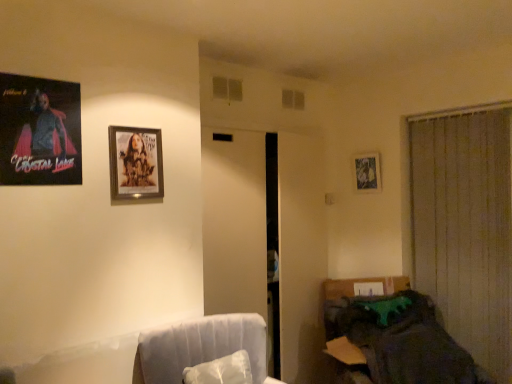
You are a GUI agent. You are given a task and a screenshot of the screen. Output one action in this format:
    pyautogui.click(x=<x>, y=<y>)
    Task: Click on the wooden frame at upper center, the 2th picture frame from the right
    This screenshot has width=512, height=384.
    Given the screenshot: What is the action you would take?
    pos(135,163)

What is the approximate height of metallic silver picture frame at upper right, the 1th picture frame when ordered from back to front?

metallic silver picture frame at upper right, the 1th picture frame when ordered from back to front, is 12.78 inches in height.

How much space does matte black poster at upper left, marked as the 3th picture frame in a back-to-front arrangement, occupy horizontally?

0.81 inches.

I want to click on beige fabric curtain at right, so click(465, 226).

Are white fabric swivel chair at lower left and wooden frame at upper center, the second picture frame when ordered from back to front, making contact?

No, white fabric swivel chair at lower left is not with wooden frame at upper center, the second picture frame when ordered from back to front.

Which of these two, white fabric swivel chair at lower left or wooden frame at upper center, the second picture frame from the left, stands taller?

white fabric swivel chair at lower left is taller.

How many degrees apart are the facing directions of white fabric swivel chair at lower left and wooden frame at upper center, the second picture frame from the left?

They differ by 17.8 degrees in their facing directions.

From the image's perspective, which one is positioned lower, metallic silver picture frame at upper right, the 1th picture frame when ordered from back to front, or wooden frame at upper center, the 2th picture frame from the right?

wooden frame at upper center, the 2th picture frame from the right, is shown below in the image.

Is metallic silver picture frame at upper right, the 3th picture frame positioned from the left, spatially inside wooden frame at upper center, the second picture frame when ordered from back to front, or outside of it?

metallic silver picture frame at upper right, the 3th picture frame positioned from the left, is not enclosed by wooden frame at upper center, the second picture frame when ordered from back to front.

Considering the sizes of objects metallic silver picture frame at upper right, the 1th picture frame when ordered from back to front, and wooden frame at upper center, the 2th picture frame from the right, in the image provided, who is thinner, metallic silver picture frame at upper right, the 1th picture frame when ordered from back to front, or wooden frame at upper center, the 2th picture frame from the right,?

wooden frame at upper center, the 2th picture frame from the right, is thinner.

Which object is more forward, beige fabric curtain at right or dark fabric couch at lower right?

dark fabric couch at lower right is closer to the camera.

Is beige fabric curtain at right touching dark fabric couch at lower right?

No, beige fabric curtain at right is not with dark fabric couch at lower right.

Can you confirm if beige fabric curtain at right is bigger than dark fabric couch at lower right?

Incorrect, beige fabric curtain at right is not larger than dark fabric couch at lower right.

Considering the relative positions of beige fabric curtain at right and dark fabric couch at lower right in the image provided, is beige fabric curtain at right to the right of dark fabric couch at lower right from the viewer's perspective?

Indeed, beige fabric curtain at right is positioned on the right side of dark fabric couch at lower right.

How far apart are matte black poster at upper left, marked as the 3th picture frame in a back-to-front arrangement, and dark fabric couch at lower right?

matte black poster at upper left, marked as the 3th picture frame in a back-to-front arrangement, and dark fabric couch at lower right are 1.93 meters apart from each other.

Can you see matte black poster at upper left, which is the 3th picture frame in right-to-left order, touching dark fabric couch at lower right?

No, matte black poster at upper left, which is the 3th picture frame in right-to-left order, is not in contact with dark fabric couch at lower right.

Which of these two, matte black poster at upper left, marked as the 3th picture frame in a back-to-front arrangement, or dark fabric couch at lower right, stands shorter?

matte black poster at upper left, marked as the 3th picture frame in a back-to-front arrangement.

From the picture: Between matte black poster at upper left, which is the 3th picture frame in right-to-left order, and dark fabric couch at lower right, which one has smaller width?

matte black poster at upper left, which is the 3th picture frame in right-to-left order, is thinner.

From the image's perspective, between dark fabric couch at lower right and metallic silver picture frame at upper right, the 1th picture frame when ordered from back to front, which one is located above?

metallic silver picture frame at upper right, the 1th picture frame when ordered from back to front, appears higher in the image.

In terms of width, does dark fabric couch at lower right look wider or thinner when compared to metallic silver picture frame at upper right, the 3th picture frame positioned from the left?

In the image, dark fabric couch at lower right appears to be wider than metallic silver picture frame at upper right, the 3th picture frame positioned from the left.

Is metallic silver picture frame at upper right, the 1th picture frame viewed from the right, located within dark fabric couch at lower right?

No, metallic silver picture frame at upper right, the 1th picture frame viewed from the right, is not inside dark fabric couch at lower right.

From a real-world perspective, is dark fabric couch at lower right on metallic silver picture frame at upper right, the 1th picture frame when ordered from back to front?

No, from a real-world perspective, dark fabric couch at lower right is not on top of metallic silver picture frame at upper right, the 1th picture frame when ordered from back to front.

In terms of height, does wooden frame at upper center, the second picture frame when ordered from back to front, look taller or shorter compared to metallic silver picture frame at upper right, the 3th picture frame positioned from the left?

In the image, wooden frame at upper center, the second picture frame when ordered from back to front, appears to be taller than metallic silver picture frame at upper right, the 3th picture frame positioned from the left.

Which object is closer to the camera taking this photo, wooden frame at upper center, the second picture frame when ordered from back to front, or metallic silver picture frame at upper right, the 1th picture frame when ordered from back to front?

wooden frame at upper center, the second picture frame when ordered from back to front, is closer to the camera.

From the image's perspective, is wooden frame at upper center, the second picture frame when ordered from back to front, above or below metallic silver picture frame at upper right, which is the third picture frame from front to back?

From the image's perspective, wooden frame at upper center, the second picture frame when ordered from back to front, appears below metallic silver picture frame at upper right, which is the third picture frame from front to back.

Can you confirm if wooden frame at upper center, the 2th picture frame from the right, is smaller than metallic silver picture frame at upper right, the 1th picture frame viewed from the right?

Indeed, wooden frame at upper center, the 2th picture frame from the right, has a smaller size compared to metallic silver picture frame at upper right, the 1th picture frame viewed from the right.

Is dark fabric couch at lower right completely or partially outside of white fabric swivel chair at lower left?

Absolutely, dark fabric couch at lower right is external to white fabric swivel chair at lower left.

In terms of height, does dark fabric couch at lower right look taller or shorter compared to white fabric swivel chair at lower left?

dark fabric couch at lower right is taller than white fabric swivel chair at lower left.

From a real-world perspective, is dark fabric couch at lower right beneath white fabric swivel chair at lower left?

Yes, from a real-world perspective, dark fabric couch at lower right is under white fabric swivel chair at lower left.

Locate an element on the screen. The height and width of the screenshot is (384, 512). the 1st picture frame counting from the left side of the white fabric swivel chair at lower left is located at coordinates (135, 163).

From a real-world perspective, starting from the metallic silver picture frame at upper right, the 1th picture frame when ordered from back to front, which picture frame is the 1st one vertically above it? Please provide its 2D coordinates.

[(135, 163)]

From the image, which object appears to be farther from dark fabric couch at lower right, wooden frame at upper center, the second picture frame from the left, or white fabric swivel chair at lower left?

wooden frame at upper center, the second picture frame from the left.

Estimate the real-world distances between objects in this image. Which object is further from matte black poster at upper left, which is counted as the first picture frame, starting from the front, beige fabric curtain at right or white fabric swivel chair at lower left?

beige fabric curtain at right lies further to matte black poster at upper left, which is counted as the first picture frame, starting from the front, than the other object.

Considering their positions, is beige fabric curtain at right positioned further to metallic silver picture frame at upper right, the 1th picture frame viewed from the right, than wooden frame at upper center, the 2th picture frame in the front-to-back sequence?

wooden frame at upper center, the 2th picture frame in the front-to-back sequence, is positioned further to the anchor metallic silver picture frame at upper right, the 1th picture frame viewed from the right.

Considering their positions, is matte black poster at upper left, which is counted as the first picture frame, starting from the front, positioned closer to wooden frame at upper center, the 2th picture frame in the front-to-back sequence, than beige fabric curtain at right?

Based on the image, matte black poster at upper left, which is counted as the first picture frame, starting from the front, appears to be nearer to wooden frame at upper center, the 2th picture frame in the front-to-back sequence.

Based on their spatial positions, is metallic silver picture frame at upper right, which is the third picture frame from front to back, or white fabric swivel chair at lower left closer to wooden frame at upper center, the second picture frame when ordered from back to front?

The object closer to wooden frame at upper center, the second picture frame when ordered from back to front, is white fabric swivel chair at lower left.

Estimate the real-world distances between objects in this image. Which object is further from beige fabric curtain at right, matte black poster at upper left, arranged as the first picture frame when viewed from the left, or white fabric swivel chair at lower left?

matte black poster at upper left, arranged as the first picture frame when viewed from the left, is positioned further to the anchor beige fabric curtain at right.

Looking at the image, which one is located further to wooden frame at upper center, the second picture frame when ordered from back to front, white fabric swivel chair at lower left or matte black poster at upper left, marked as the 3th picture frame in a back-to-front arrangement?

Among the two, white fabric swivel chair at lower left is located further to wooden frame at upper center, the second picture frame when ordered from back to front.

Considering their positions, is dark fabric couch at lower right positioned closer to matte black poster at upper left, arranged as the first picture frame when viewed from the left, than white fabric swivel chair at lower left?

The object closer to matte black poster at upper left, arranged as the first picture frame when viewed from the left, is white fabric swivel chair at lower left.

The height and width of the screenshot is (384, 512). What are the coordinates of `picture frame between wooden frame at upper center, the second picture frame from the left, and dark fabric couch at lower right from left to right` in the screenshot? It's located at (367, 173).

Locate an element on the screen. The image size is (512, 384). swivel chair between wooden frame at upper center, the 2th picture frame in the front-to-back sequence, and beige fabric curtain at right from left to right is located at coordinates pyautogui.click(x=200, y=346).

The width and height of the screenshot is (512, 384). In order to click on swivel chair between matte black poster at upper left, which is the 3th picture frame in right-to-left order, and beige fabric curtain at right, in the horizontal direction in this screenshot , I will do `click(200, 346)`.

Locate an element on the screen. The width and height of the screenshot is (512, 384). swivel chair located between matte black poster at upper left, marked as the 3th picture frame in a back-to-front arrangement, and dark fabric couch at lower right in the left-right direction is located at coordinates (200, 346).